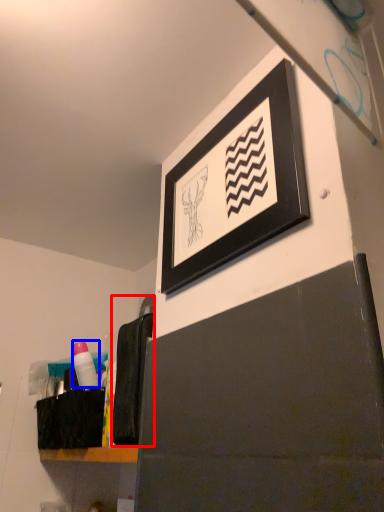
Question: Which of the following is the closest to the observer, laundry (highlighted by a red box) or toiletry (highlighted by a blue box)?

Choices:
 (A) laundry
 (B) toiletry

Answer: (A)